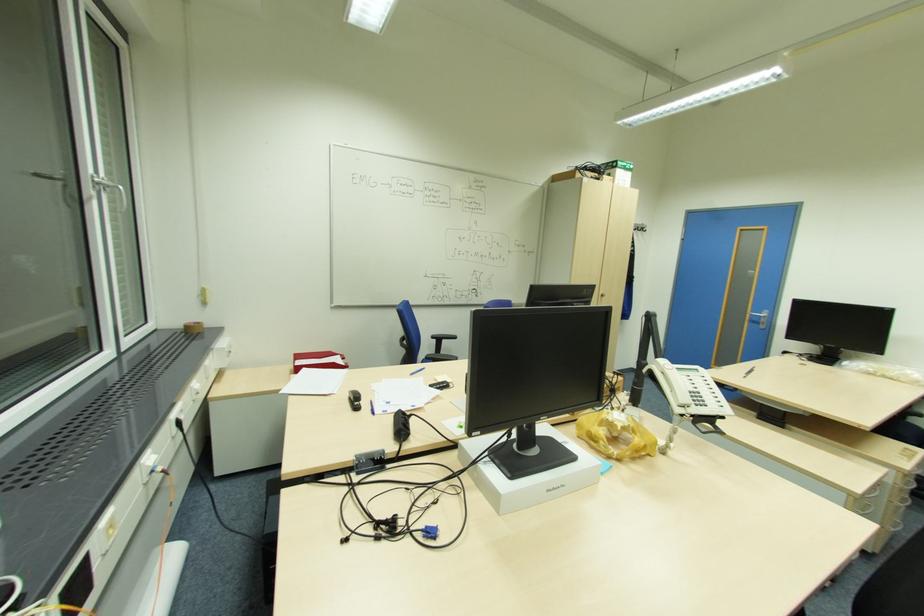
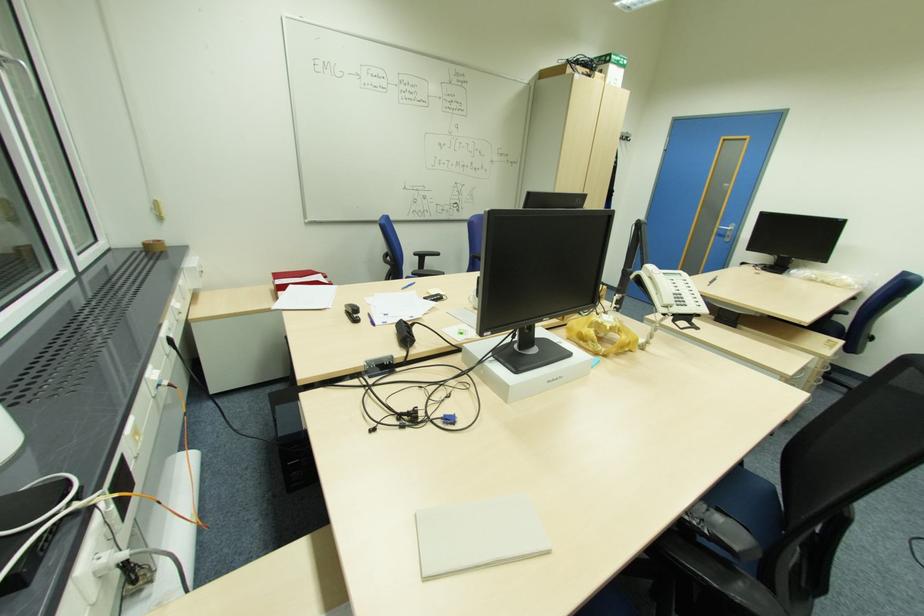
Question: I am providing you with two images of the same scene from different viewpoints. Which of the following objects are not visible in image2?

Choices:
 (A) silver door handle
 (B) blue chair sitting surface
 (C) white closed notebook
 (D) none of these

Answer: (D)